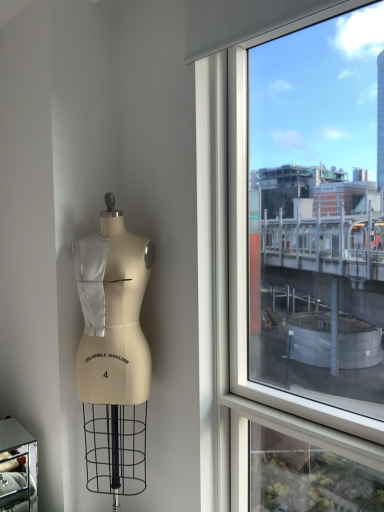
Identify the location of transparent glass window at upper right. (238, 250).

The image size is (384, 512). What do you see at coordinates (238, 250) in the screenshot?
I see `transparent glass window at upper right` at bounding box center [238, 250].

The image size is (384, 512). In order to click on transparent glass window at upper right in this screenshot , I will do `click(238, 250)`.